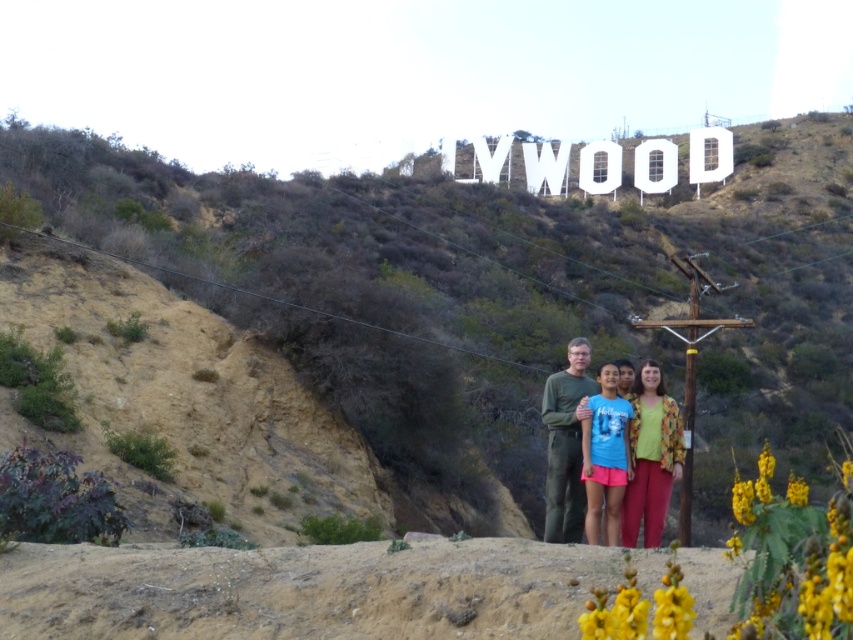
Does matte green shirt at center appear under green matte shirt at center?

Result: No.

Is matte green shirt at center shorter than green matte shirt at center?

Yes.

Between point (578, 461) and point (553, 534), which one is positioned in front?

Point (553, 534)

Find the location of a particular element. matte green shirt at center is located at coordinates (566, 442).

Does matte green shirt at center have a greater height compared to blue t-shirt at center?

Correct, matte green shirt at center is much taller as blue t-shirt at center.

This screenshot has width=853, height=640. What do you see at coordinates (566, 442) in the screenshot?
I see `matte green shirt at center` at bounding box center [566, 442].

Is point (573, 412) more distant than point (610, 394)?

No, it is not.

What are the coordinates of `matte green shirt at center` in the screenshot? It's located at point(566,442).

Is the position of green matte shirt at center more distant than that of blue t-shirt at center?

That is True.

Does green matte shirt at center have a larger size compared to blue t-shirt at center?

Correct, green matte shirt at center is larger in size than blue t-shirt at center.

The width and height of the screenshot is (853, 640). What do you see at coordinates (566, 444) in the screenshot?
I see `green matte shirt at center` at bounding box center [566, 444].

Locate an element on the screen. Image resolution: width=853 pixels, height=640 pixels. green matte shirt at center is located at coordinates (566, 444).